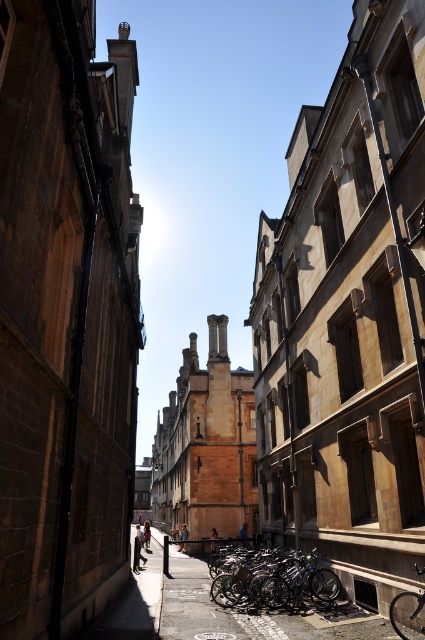
Between metallic bicycle at lower center and shiny metallic bicycle at center, which one has more height?

metallic bicycle at lower center is taller.

Is the position of metallic bicycle at lower center more distant than that of shiny metallic bicycle at center?

Yes, metallic bicycle at lower center is behind shiny metallic bicycle at center.

Between point (153, 586) and point (408, 596), which one is positioned behind?

Point (153, 586)

Locate an element on the screen. This screenshot has width=425, height=640. metallic bicycle at lower center is located at coordinates (135, 604).

Can you confirm if shiny metallic bicycles at center is smaller than shiny metallic bicycle at center?

Incorrect, shiny metallic bicycles at center is not smaller in size than shiny metallic bicycle at center.

Which is behind, point (282, 580) or point (391, 612)?

The point (282, 580) is more distant.

Where is `shiny metallic bicycles at center`? Image resolution: width=425 pixels, height=640 pixels. shiny metallic bicycles at center is located at coordinates (274, 579).

Who is positioned more to the right, brown stone building at left or shiny metallic bicycle at center?

Positioned to the right is shiny metallic bicycle at center.

Is brown stone building at left shorter than shiny metallic bicycle at center?

Incorrect, brown stone building at left's height does not fall short of shiny metallic bicycle at center's.

You are a GUI agent. You are given a task and a screenshot of the screen. Output one action in this format:
    pyautogui.click(x=<x>, y=<y>)
    Task: Click on the brown stone building at left
    
    Given the screenshot: What is the action you would take?
    pyautogui.click(x=65, y=316)

Identify the location of brown stone building at left. This screenshot has height=640, width=425. (65, 316).